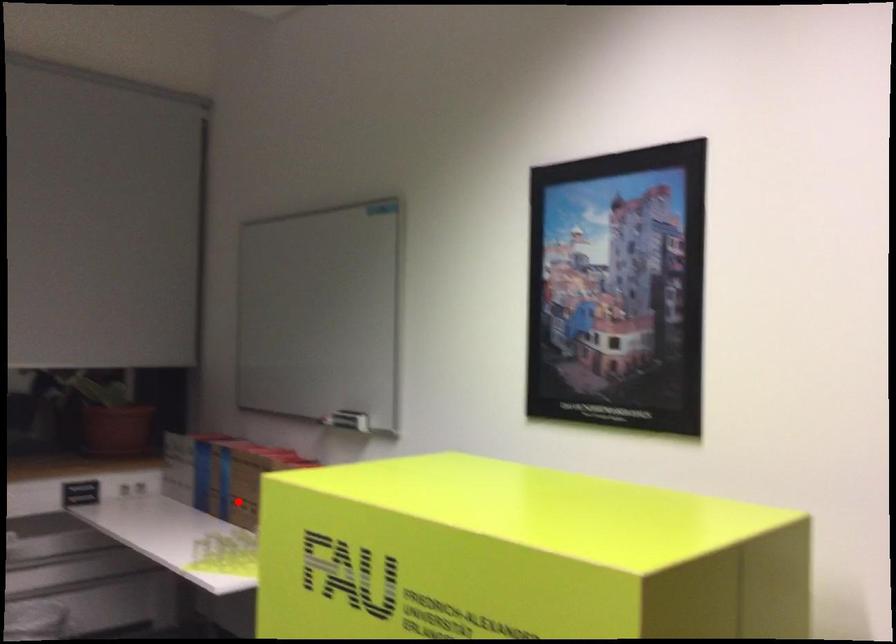
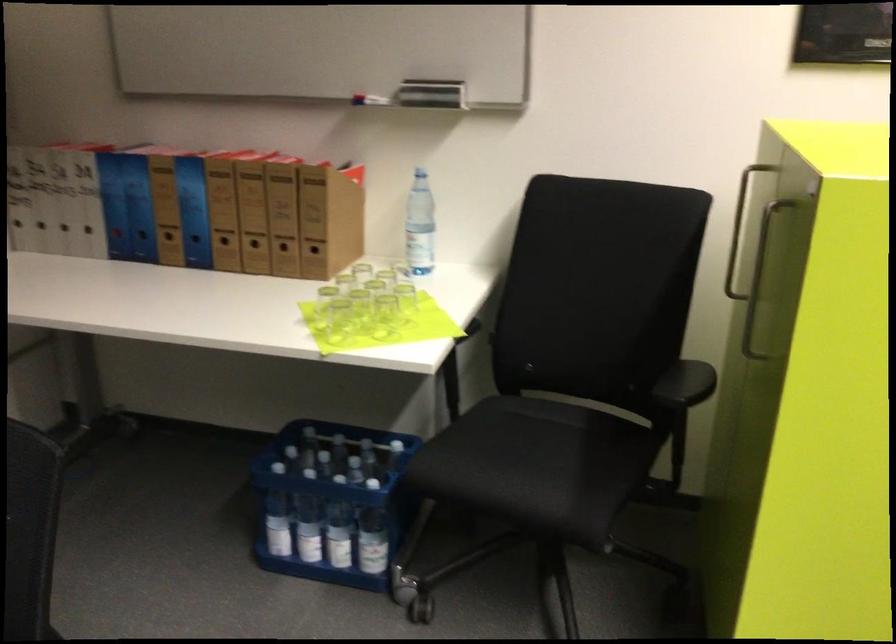
Question: I am providing you with two images of the same scene from different viewpoints. Given a red point in image1, look at the same physical point in image2. Is it:

Choices:
 (A) Closer to the viewpoint
 (B) Farther from the viewpoint

Answer: (A)